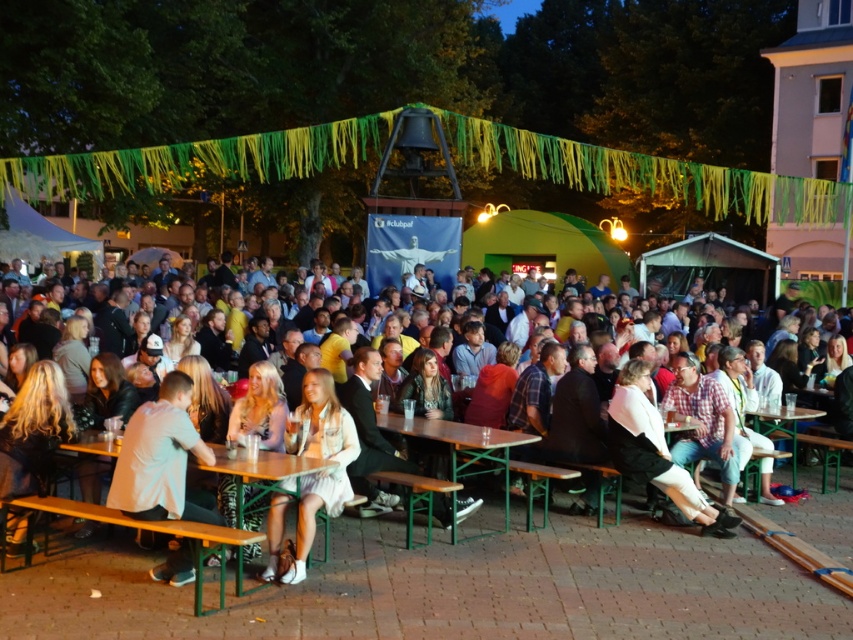
You are a photographer at the event and want to capture a photo of the wooden table at center without the white leather shoes at center appearing in the shot. How should you adjust your camera angle?

To avoid capturing the white leather shoes at center in the photo, position the camera higher so that it looks down at the wooden table at center from above, ensuring the shoes are out of frame or obscured by the table itself since the white leather shoes at center is below the wooden table at center.